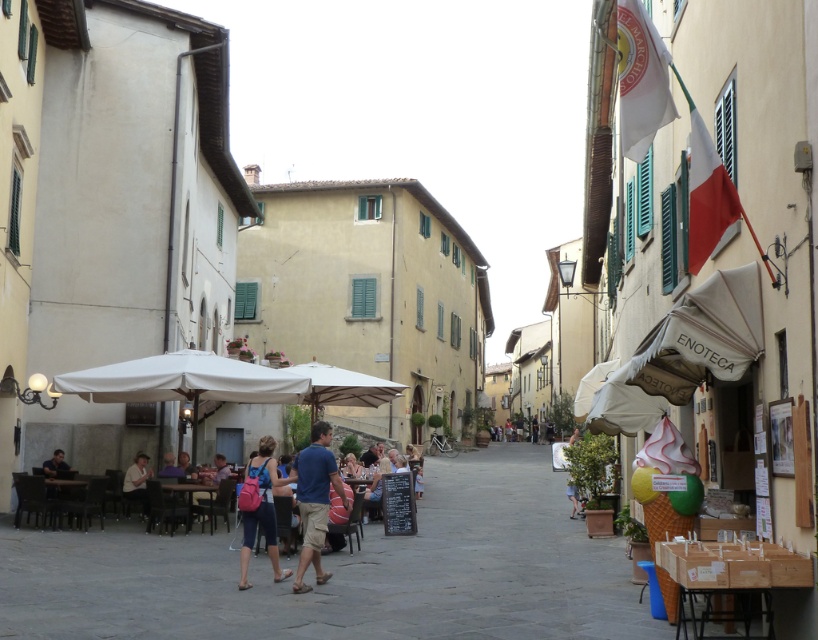
In the scene shown: Is white fabric umbrella at center shorter than blue cotton shirt at center?

Yes.

In the scene shown: Is white fabric umbrella at center below blue cotton shirt at center?

No, white fabric umbrella at center is not below blue cotton shirt at center.

Which is in front, point (75, 381) or point (321, 428)?

Point (321, 428)

Identify the location of white fabric umbrella at center. (183, 381).

Looking at this image, does light brown leather jacket at lower left appear on the right side of light blue denim shorts at lower right?

Incorrect, light brown leather jacket at lower left is not on the right side of light blue denim shorts at lower right.

Is point (135, 458) positioned in front of point (573, 515)?

Yes, it is.

Describe the element at coordinates (137, 481) in the screenshot. I see `light brown leather jacket at lower left` at that location.

Identify the location of light brown leather jacket at lower left. (137, 481).

Consider the image. Which is more to the left, white fabric umbrella at center or light brown leather jacket at lower left?

light brown leather jacket at lower left

Who is more forward, (73,374) or (140,465)?

Point (73,374) is more forward.

The height and width of the screenshot is (640, 818). Find the location of `white fabric umbrella at center`. white fabric umbrella at center is located at coordinates (183, 381).